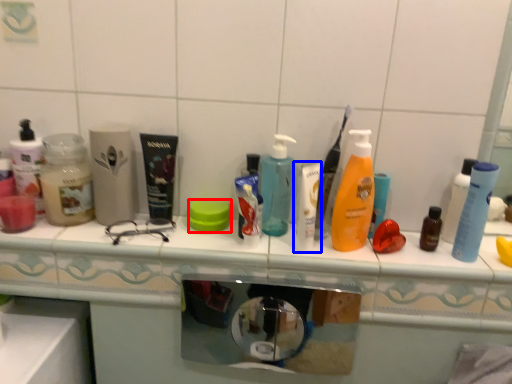
Question: Which object is further to the camera taking this photo, soap (highlighted by a red box) or toiletry (highlighted by a blue box)?

Choices:
 (A) soap
 (B) toiletry

Answer: (A)